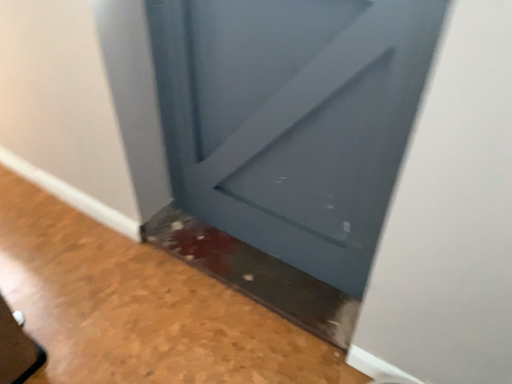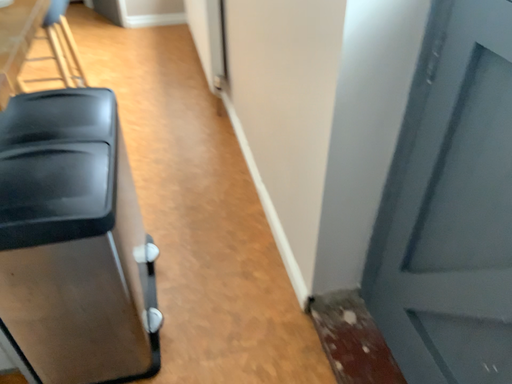
Question: Which way did the camera rotate in the video?

Choices:
 (A) rotated downward
 (B) rotated upward

Answer: (B)